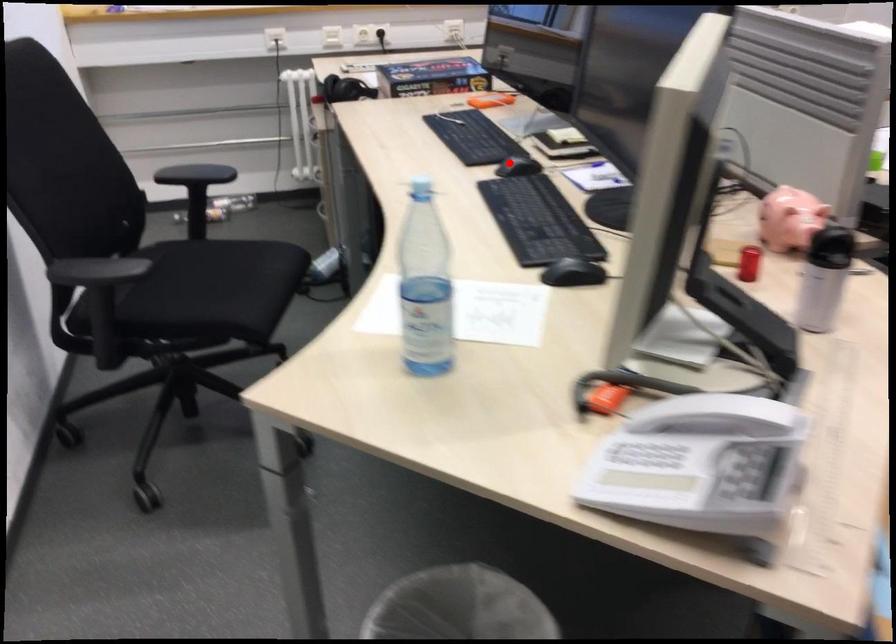
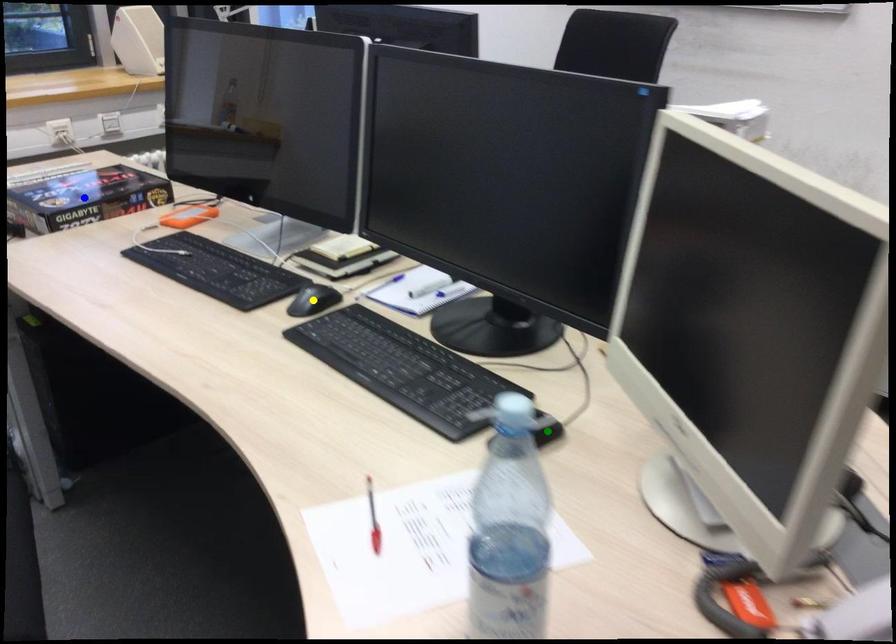
Question: I am providing you with two images of the same scene from different viewpoints. A red point is marked on the first image. You are given multiple points on the second image. Which point in image 2 is actually the same real-world point as the red point in image 1?

Choices:
 (A) yellow point
 (B) blue point
 (C) green point

Answer: (A)